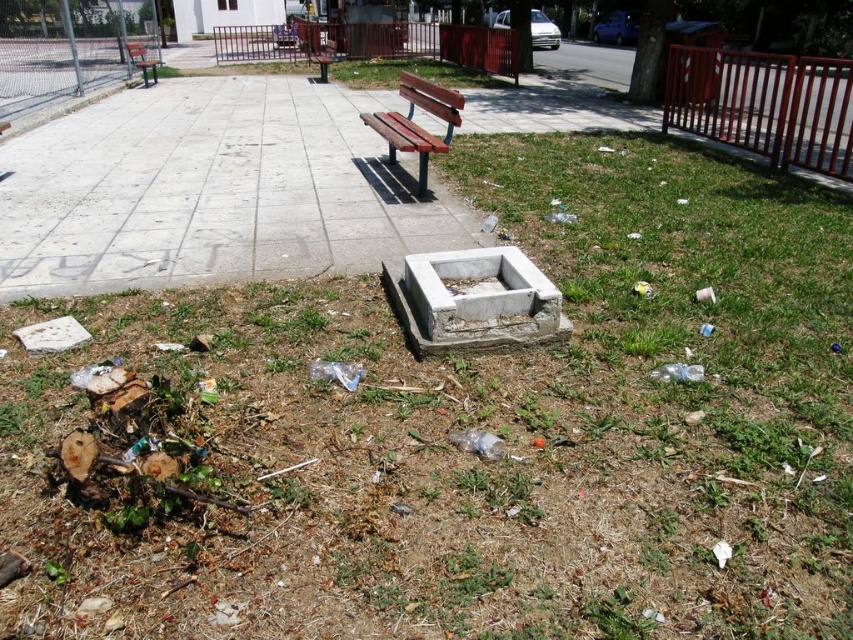
Question: Which is nearer to the concrete pavement at center?

Choices:
 (A) wooden bench at center
 (B) wooden bench at upper left

Answer: (A)

Question: Observing the image, what is the correct spatial positioning of wooden bench at center in reference to wooden bench at upper left?

Choices:
 (A) above
 (B) below

Answer: (B)

Question: Which object appears farthest from the camera in this image?

Choices:
 (A) wooden bench at upper left
 (B) wooden bench at center
 (C) concrete pavement at center

Answer: (A)

Question: Which point is closer to the camera taking this photo?

Choices:
 (A) (445, 118)
 (B) (141, 70)

Answer: (A)

Question: Does wooden bench at center appear over wooden bench at upper left?

Choices:
 (A) no
 (B) yes

Answer: (A)

Question: Observing the image, what is the correct spatial positioning of concrete pavement at center in reference to wooden bench at center?

Choices:
 (A) right
 (B) left

Answer: (B)